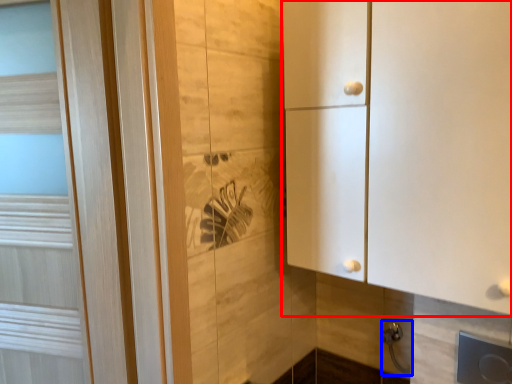
Question: Among these objects, which one is farthest to the camera, cupboard (highlighted by a red box) or door handle (highlighted by a blue box)?

Choices:
 (A) cupboard
 (B) door handle

Answer: (B)